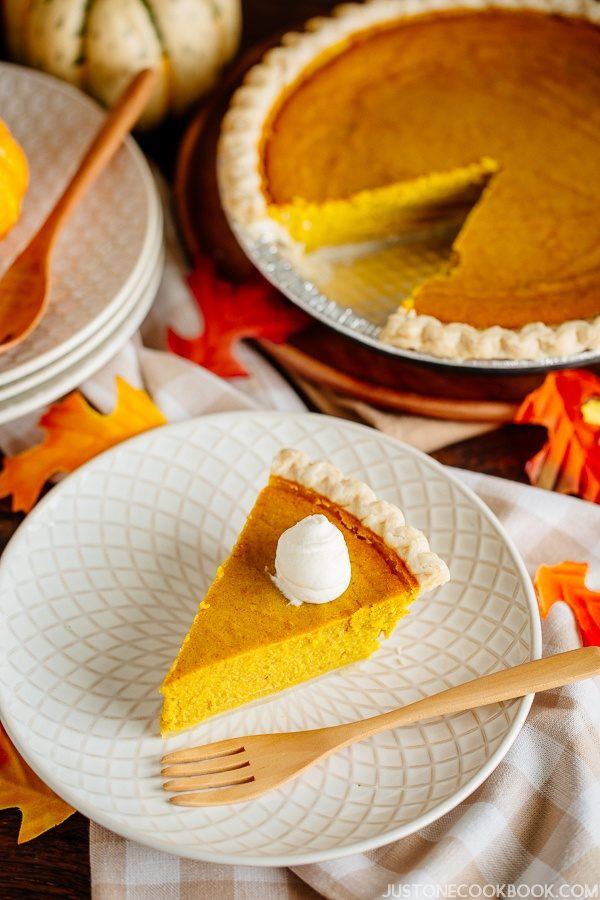
Where is `napkin`? Image resolution: width=600 pixels, height=900 pixels. napkin is located at coordinates (569, 816), (186, 364).